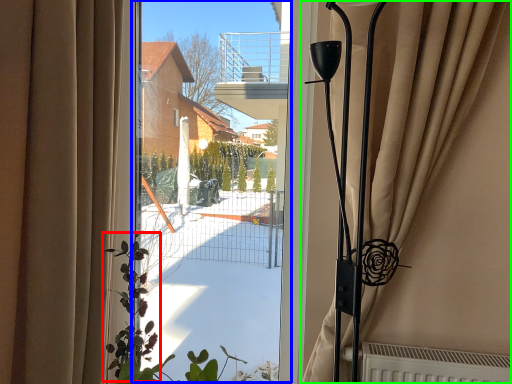
Question: Considering the real-world distances, which object is closest to plant (highlighted by a red box)? window screen (highlighted by a blue box) or curtain (highlighted by a green box).

Choices:
 (A) window screen
 (B) curtain

Answer: (A)